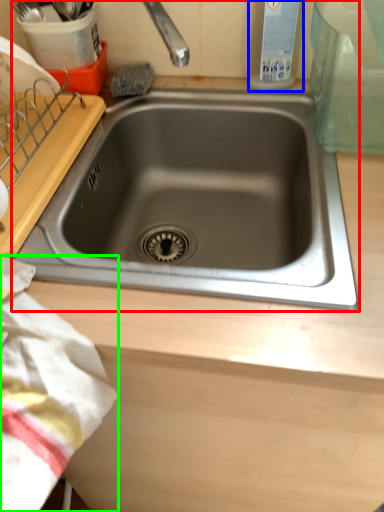
Question: Estimate the real-world distances between objects in this image. Which object is closer to sink (highlighted by a red box), bottle (highlighted by a blue box) or blanket (highlighted by a green box)?

Choices:
 (A) bottle
 (B) blanket

Answer: (A)